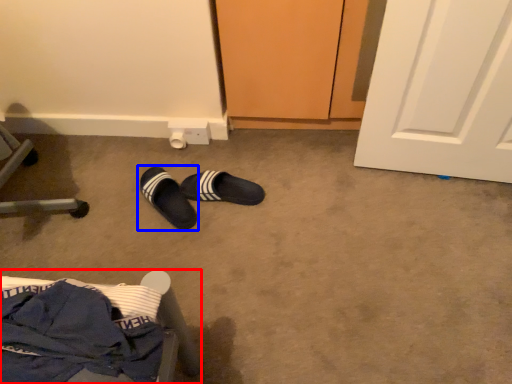
Question: Which of the following is the farthest to the observer, furniture (highlighted by a red box) or footwear (highlighted by a blue box)?

Choices:
 (A) furniture
 (B) footwear

Answer: (B)